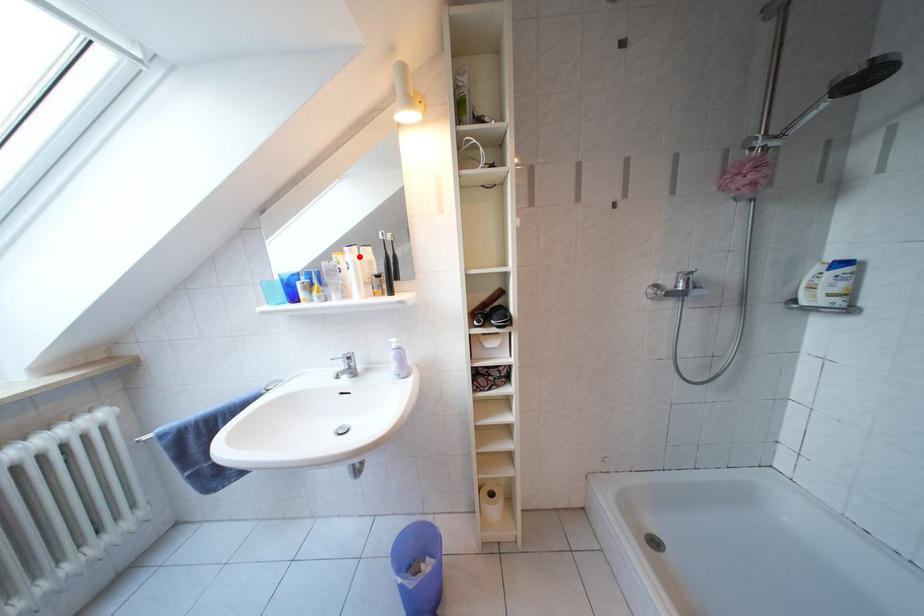
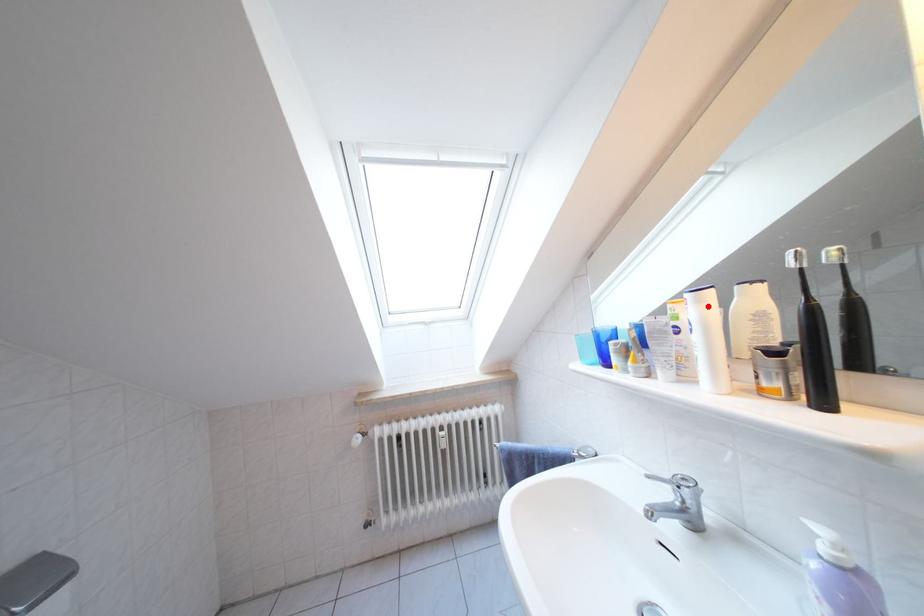
Based on the photo, I am providing you with two images of the same scene from different viewpoints. A red point is marked on the first image and another point is marked on the second image. Is the marked point in image1 the same physical position as the marked point in image2?

Yes